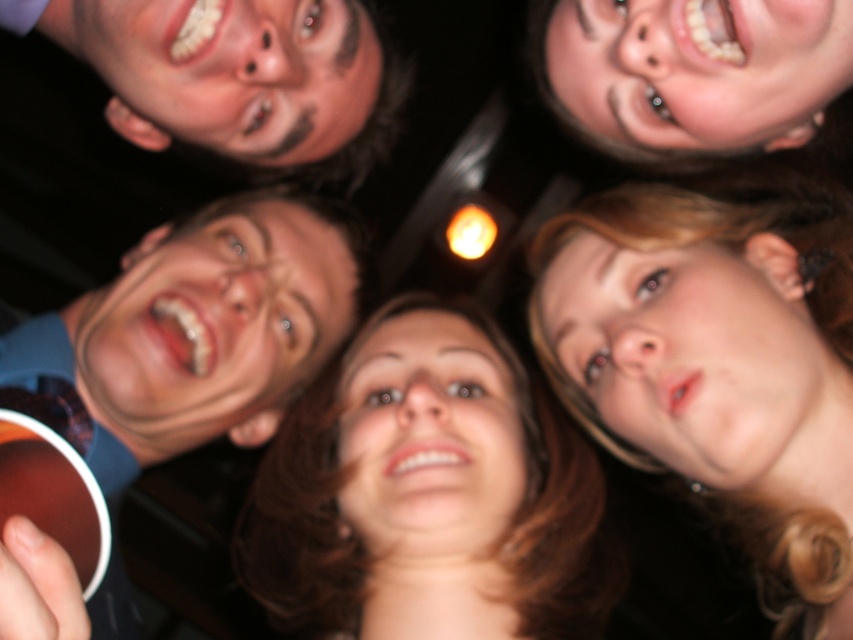
Question: Is blonde hair at center bigger than smooth brown hair at center?

Choices:
 (A) no
 (B) yes

Answer: (A)

Question: Is blue fabric shirt at upper left to the left of matte black face at upper left from the viewer's perspective?

Choices:
 (A) no
 (B) yes

Answer: (B)

Question: Is blue fabric shirt at upper left to the left of matte black face at upper left from the viewer's perspective?

Choices:
 (A) no
 (B) yes

Answer: (B)

Question: Which of the following is the farthest from the observer?

Choices:
 (A) blue fabric shirt at upper left
 (B) blonde hair at center

Answer: (A)

Question: Based on their relative distances, which object is nearer to the blonde hair at center?

Choices:
 (A) smooth skin face at upper right
 (B) smooth brown hair at center
 (C) matte black face at upper left

Answer: (B)

Question: Which object appears farthest from the camera in this image?

Choices:
 (A) smooth brown hair at center
 (B) blonde hair at center
 (C) matte black face at upper left
 (D) blue fabric shirt at upper left

Answer: (D)